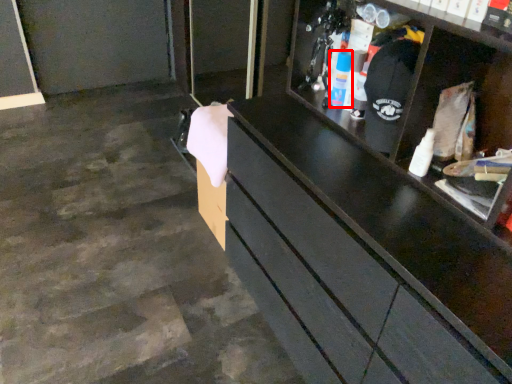
Question: From the image's perspective, what is the correct spatial positioning of toiletry (annotated by the red box) in reference to toiletry?

Choices:
 (A) above
 (B) below

Answer: (A)